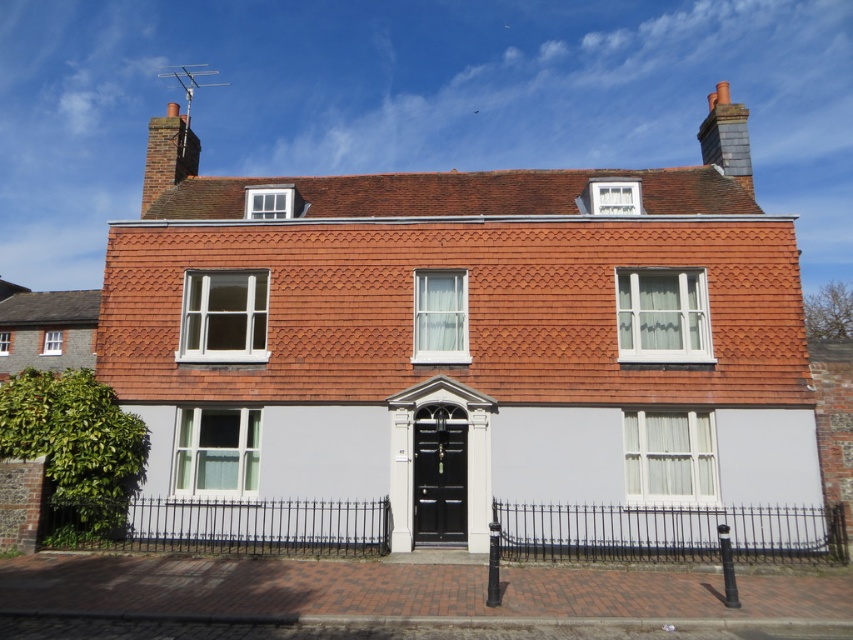
Is red brick chimney at upper left wider than gray slate chimney at upper right?

No.

Does red brick chimney at upper left have a larger size compared to gray slate chimney at upper right?

Actually, red brick chimney at upper left might be smaller than gray slate chimney at upper right.

What do you see at coordinates (460, 339) in the screenshot? Image resolution: width=853 pixels, height=640 pixels. I see `red brick chimney at upper left` at bounding box center [460, 339].

Identify the location of red brick chimney at upper left. Image resolution: width=853 pixels, height=640 pixels. (460, 339).